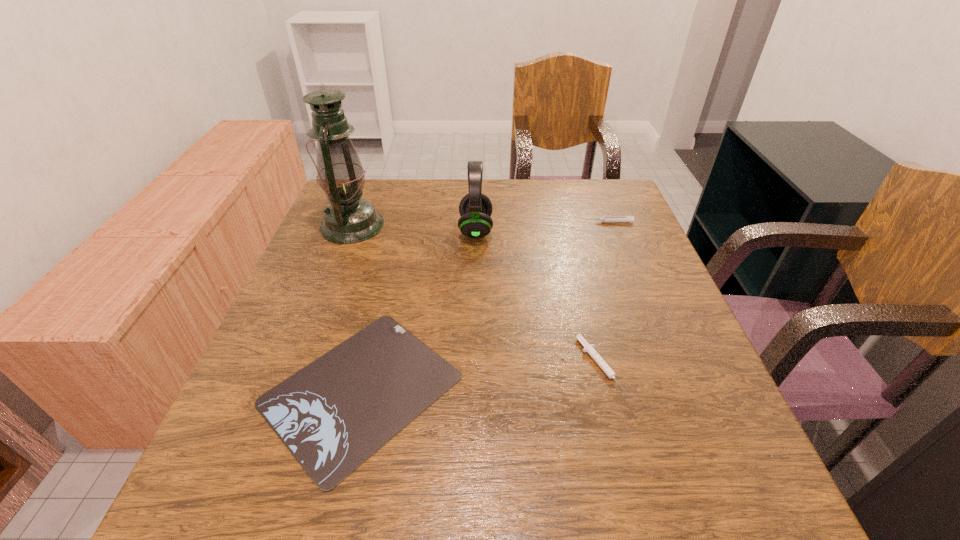
Locate an element on the screen. free point between the shortest object and the oil lamp is located at coordinates 357,307.

This screenshot has width=960, height=540. Identify the location of free space that is in between the shorter syringe and the fourth shortest object. (538, 298).

Find the location of a particular element. This screenshot has height=540, width=960. vacant space that is in between the rightmost object and the shortest object is located at coordinates (486, 306).

Where is `vacant area between the second object from right to left and the oil lamp`? The width and height of the screenshot is (960, 540). vacant area between the second object from right to left and the oil lamp is located at coordinates (476, 295).

The width and height of the screenshot is (960, 540). Identify the location of unoccupied position between the left syringe and the second tallest object. (538, 298).

Image resolution: width=960 pixels, height=540 pixels. Find the location of `free area in between the shortest object and the headset`. free area in between the shortest object and the headset is located at coordinates (419, 309).

Where is `vacant space that's between the tallest object and the mousepad`? Image resolution: width=960 pixels, height=540 pixels. vacant space that's between the tallest object and the mousepad is located at coordinates (357, 307).

Locate an element on the screen. free space between the second object from right to left and the oil lamp is located at coordinates (476, 295).

You are a GUI agent. You are given a task and a screenshot of the screen. Output one action in this format:
    pyautogui.click(x=<x>, y=<y>)
    Task: Click on the free area in between the headset and the fourth object from left to right
    The image size is (960, 540).
    Given the screenshot: What is the action you would take?
    pyautogui.click(x=538, y=298)

Where is `free space between the shortest object and the right syringe`? free space between the shortest object and the right syringe is located at coordinates (486, 306).